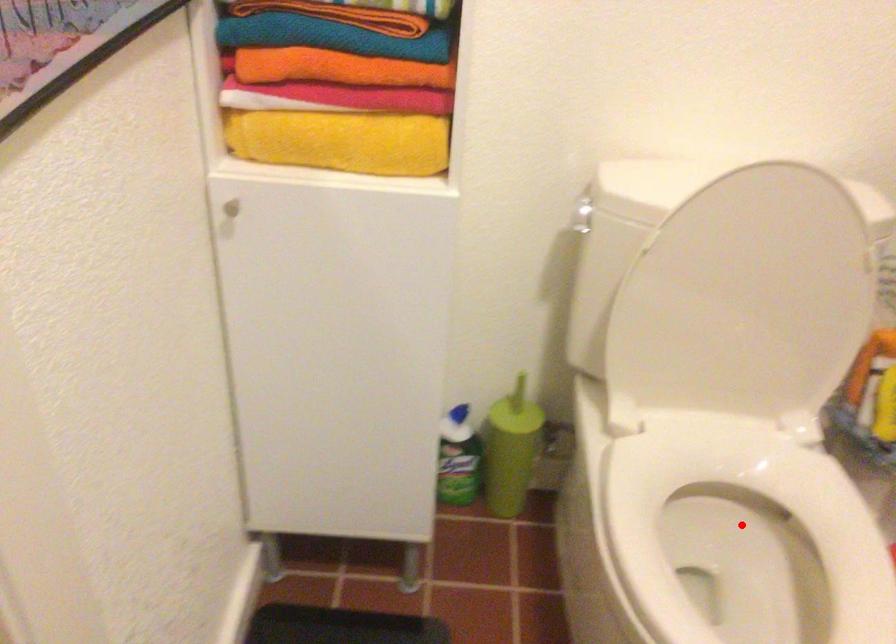
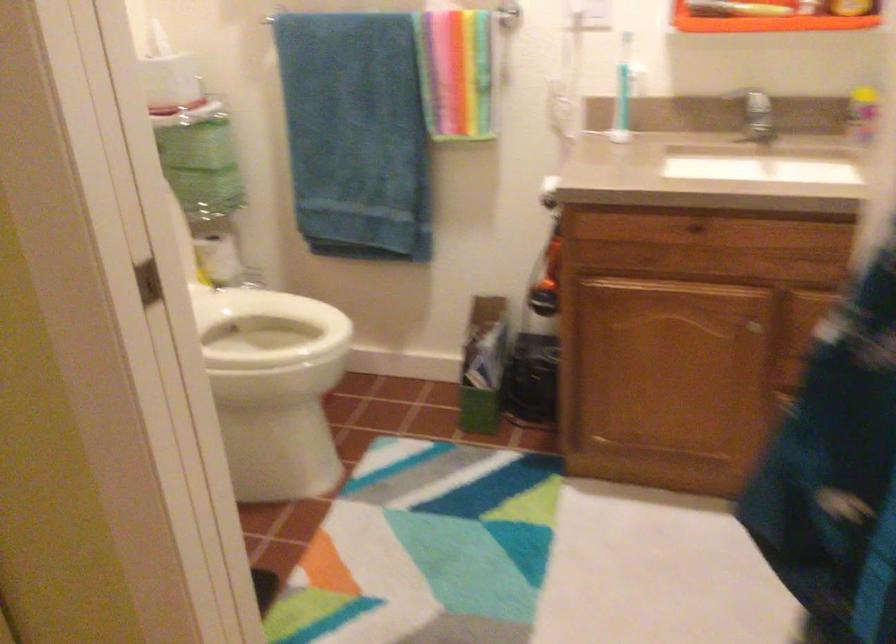
Question: I am providing you with two images of the same scene from different viewpoints. A red point is marked on the first image. Can you still see the location of the red point in image 2?

Choices:
 (A) Yes
 (B) No

Answer: (B)